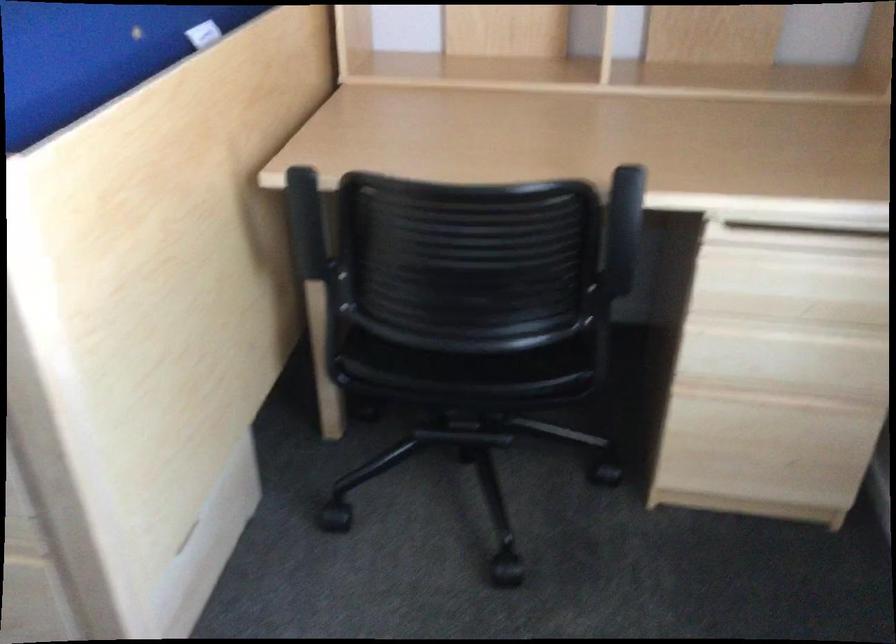
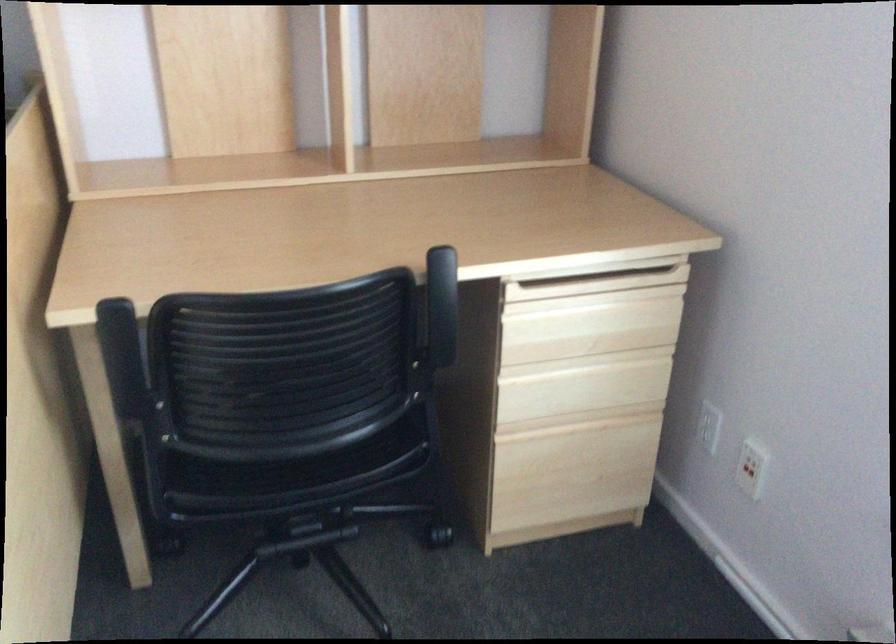
The point at [449,348] is marked in the first image. Where is the corresponding point in the second image?

(296, 455)